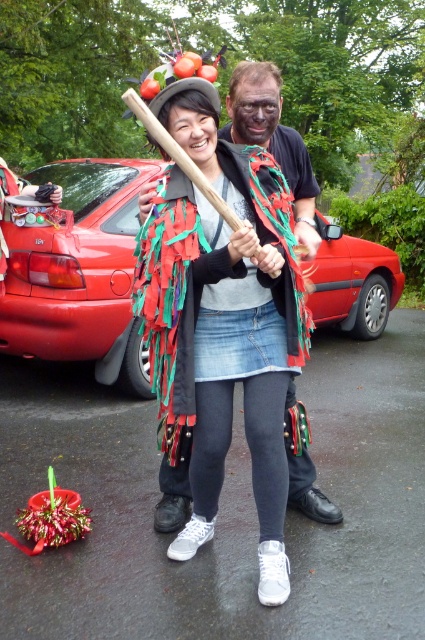
You are a photographer trying to capture a clear shot of the red matte car at center without any obstructions. Is the multicolored fabric cape at center blocking the view of the car?

The multicolored fabric cape at center is behind the red matte car at center, so it is not blocking the view of the car.

You are a delivery person trying to park your delivery van in the parking lot. There is a red matte car at center at point (79, 272). Can you park your van here?

There is a red matte car at center at point (79, 272), so you cannot park your van here because the spot is already occupied.